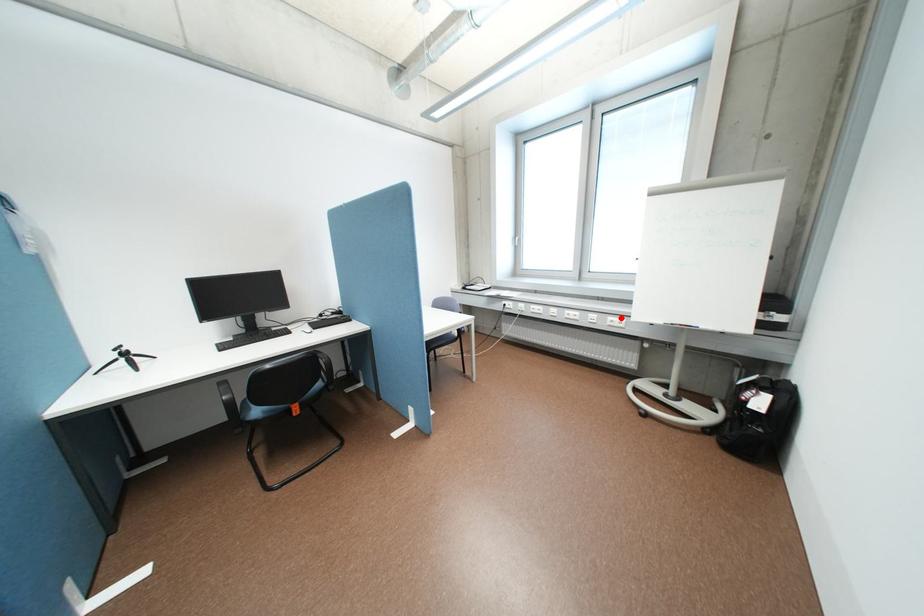
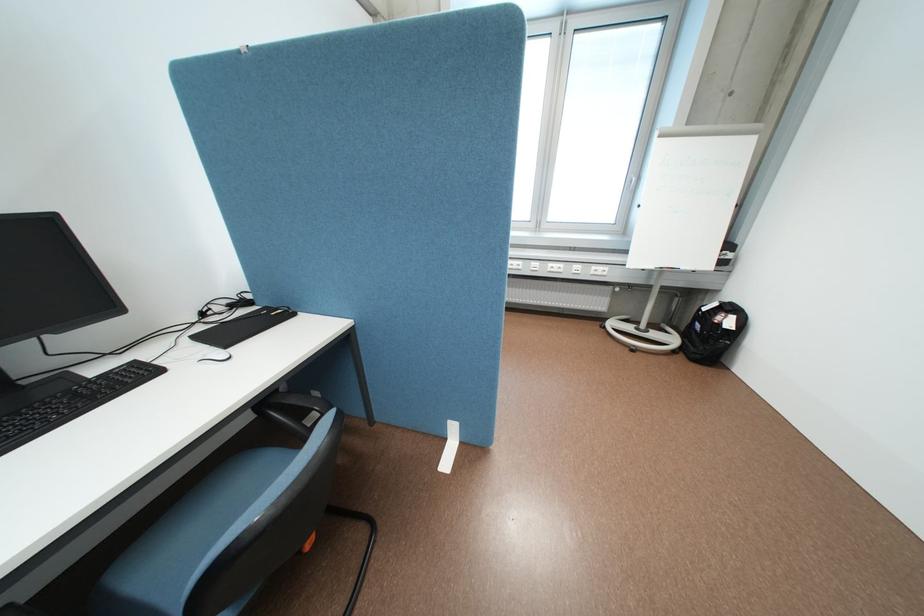
Locate, in the second image, the point that corresponds to the highlighted location in the first image.

(604, 267)